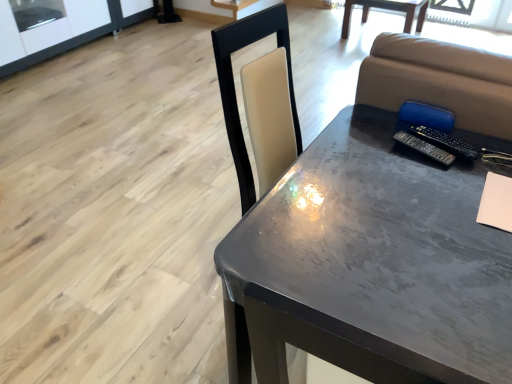
Question: Considering the relative positions of metallic gray table at center, arranged as the first table when viewed from the right, and black plastic remote at upper right, which ranks as the second remote in left-to-right order, in the image provided, is metallic gray table at center, arranged as the first table when viewed from the right, to the left of black plastic remote at upper right, which ranks as the second remote in left-to-right order, from the viewer's perspective?

Choices:
 (A) no
 (B) yes

Answer: (A)

Question: Can we say metallic gray table at center, which appears as the 1th table when viewed from the top, lies outside black plastic remote at upper right, which is counted as the first remote, starting from the right?

Choices:
 (A) yes
 (B) no

Answer: (A)

Question: Is metallic gray table at center, arranged as the first table when viewed from the right, aimed at black plastic remote at upper right, which ranks as the second remote in left-to-right order?

Choices:
 (A) yes
 (B) no

Answer: (A)

Question: Considering the relative sizes of metallic gray table at center, the 2th table ordered from the bottom, and black plastic remote at upper right, which ranks as the second remote in left-to-right order, in the image provided, is metallic gray table at center, the 2th table ordered from the bottom, thinner than black plastic remote at upper right, which ranks as the second remote in left-to-right order,?

Choices:
 (A) no
 (B) yes

Answer: (A)

Question: From the image's perspective, is metallic gray table at center, which appears as the 1th table when viewed from the top, above black plastic remote at upper right, which is counted as the first remote, starting from the right?

Choices:
 (A) no
 (B) yes

Answer: (B)

Question: From a real-world perspective, is metallic gray table at center, the second table from the left, beneath black plastic remote at upper right, which ranks as the second remote in left-to-right order?

Choices:
 (A) yes
 (B) no

Answer: (A)

Question: Can you confirm if metallic gray table at center, the 2th table positioned from the back, is thinner than transparent glass window screen at upper left?

Choices:
 (A) no
 (B) yes

Answer: (A)

Question: From the image's perspective, is metallic gray table at center, which is the first table in bottom-to-top order, on top of transparent glass window screen at upper left?

Choices:
 (A) no
 (B) yes

Answer: (A)

Question: Is there a large distance between metallic gray table at center, acting as the 2th table starting from the top, and transparent glass window screen at upper left?

Choices:
 (A) no
 (B) yes

Answer: (B)

Question: Does metallic gray table at center, which is the 1th table in left-to-right order, have a larger size compared to transparent glass window screen at upper left?

Choices:
 (A) yes
 (B) no

Answer: (A)

Question: Considering the relative positions of metallic gray table at center, positioned as the 1th table in front-to-back order, and transparent glass window screen at upper left in the image provided, is metallic gray table at center, positioned as the 1th table in front-to-back order, to the left of transparent glass window screen at upper left from the viewer's perspective?

Choices:
 (A) yes
 (B) no

Answer: (B)

Question: Is metallic gray table at center, acting as the 2th table starting from the top, aimed at transparent glass window screen at upper left?

Choices:
 (A) no
 (B) yes

Answer: (A)

Question: Is black plastic remote at right, which appears as the first remote when viewed from the left, bigger than beige matte notebook at lower right?

Choices:
 (A) no
 (B) yes

Answer: (A)